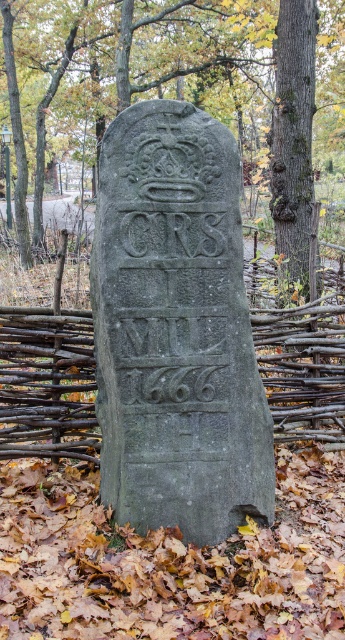
Question: Which point is closer to the camera taking this photo?

Choices:
 (A) (179, 314)
 (B) (276, 81)
 (C) (51, 65)

Answer: (A)

Question: Which object is positioned farthest from the green mossy tree at center?

Choices:
 (A) gray stone gravestone at center
 (B) green mossy bark tree at center right
 (C) brown wooden fence at center

Answer: (A)

Question: Does green mossy tree at center have a lesser width compared to brown wooden fence at center?

Choices:
 (A) no
 (B) yes

Answer: (A)

Question: Can you confirm if green mossy tree at center is positioned to the left of green mossy bark tree at center right?

Choices:
 (A) yes
 (B) no

Answer: (A)

Question: Which point is farther from the camera taking this photo?

Choices:
 (A) (244, 129)
 (B) (115, 138)
 (C) (294, 262)

Answer: (A)

Question: Is green mossy tree at center to the left of green mossy bark tree at center right from the viewer's perspective?

Choices:
 (A) no
 (B) yes

Answer: (B)